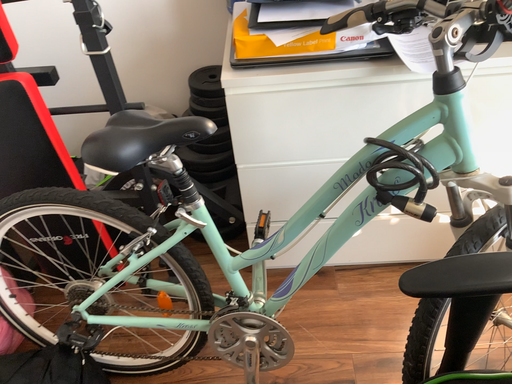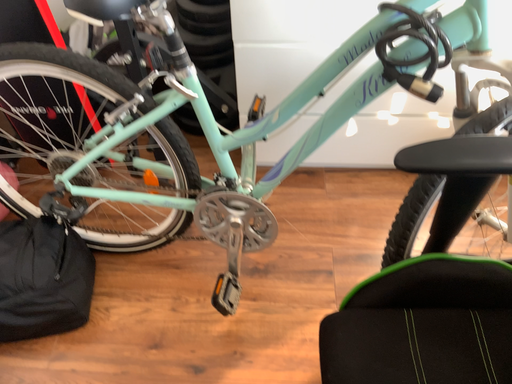
Question: Which way did the camera rotate in the video?

Choices:
 (A) rotated upward
 (B) rotated downward

Answer: (B)